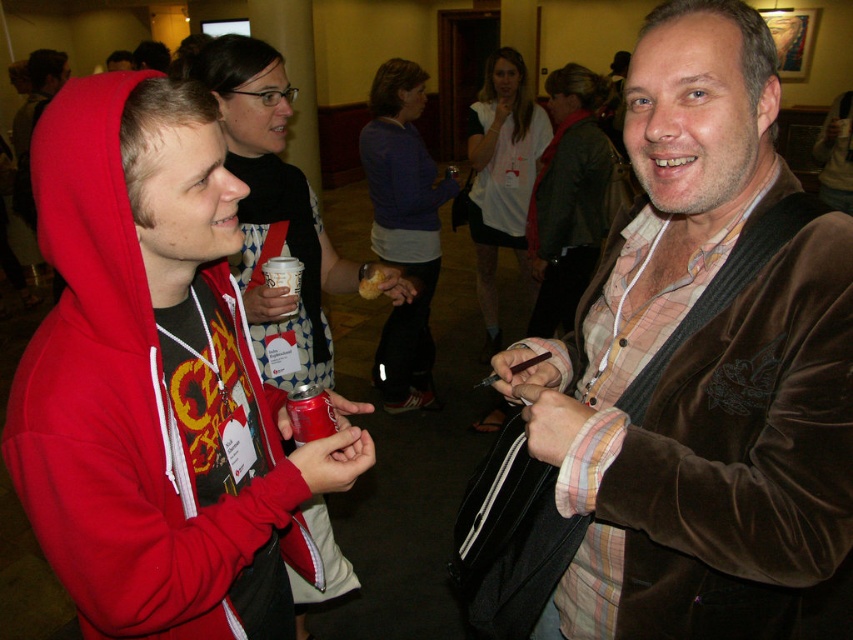
You are organizing a coat rack in the room and want to place the velvet brown jacket at center and the white paper cup at center on it. Since the coat rack has limited space, can you determine which item takes up more horizontal space?

The velvet brown jacket at center has a greater width than the white paper cup at center, so it occupies more horizontal space and requires more room on the coat rack.

You are standing at point (283,282) and want to move towards point (300,413). Is the path clear between these two points?

Yes, the path between point (300,413) and point (283,282) is clear because point (300,413) is in front of point (283,282), indicating no obstruction.

You are standing in the hallway and need to find the velvet brown jacket at center. According to the spatial description, where would you look relative to the other objects in the scene?

The velvet brown jacket at center is located at point 0.572 on the x axis and 0.821 on the y axis, so you should look towards the center area of the image slightly to the right and lower middle section.